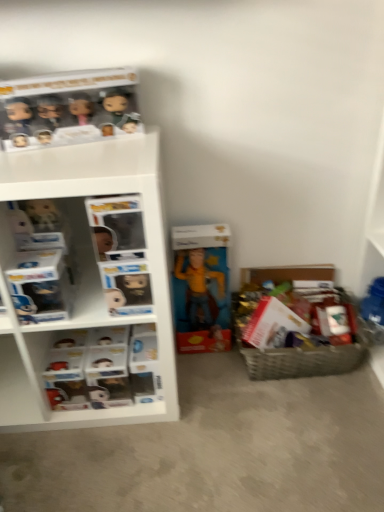
Identify the location of vacant space in front of white plastic shelves at left. Image resolution: width=384 pixels, height=512 pixels. (108, 454).